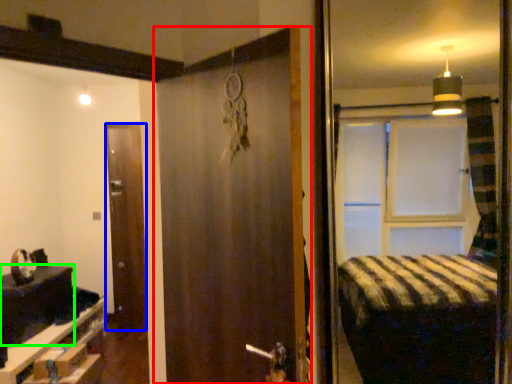
Question: Based on their relative distances, which object is farther from door (highlighted by a red box)? Choose from door (highlighted by a blue box) and table (highlighted by a green box).

Choices:
 (A) door
 (B) table

Answer: (A)